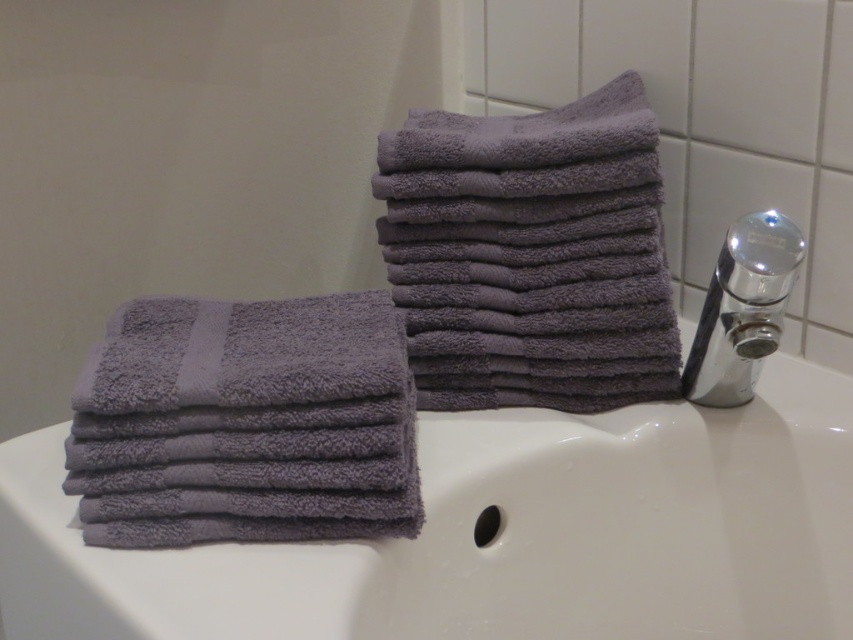
Question: Which point appears farthest from the camera in this image?

Choices:
 (A) (190, 355)
 (B) (770, 301)
 (C) (601, 305)

Answer: (C)

Question: Is purple terry cloth towels at upper right to the right of chrome metallic faucet at upper right from the viewer's perspective?

Choices:
 (A) yes
 (B) no

Answer: (B)

Question: Is purple terry cloth towels at upper right smaller than chrome metallic faucet at upper right?

Choices:
 (A) no
 (B) yes

Answer: (A)

Question: Estimate the real-world distances between objects in this image. Which object is farther from the purple terry cloth towel at left?

Choices:
 (A) purple terry cloth towels at upper right
 (B) chrome metallic faucet at upper right

Answer: (B)

Question: Among these points, which one is nearest to the camera?

Choices:
 (A) (722, 340)
 (B) (611, 211)

Answer: (A)

Question: Is purple terry cloth towels at upper right to the left of purple terry cloth towel at left from the viewer's perspective?

Choices:
 (A) no
 (B) yes

Answer: (A)